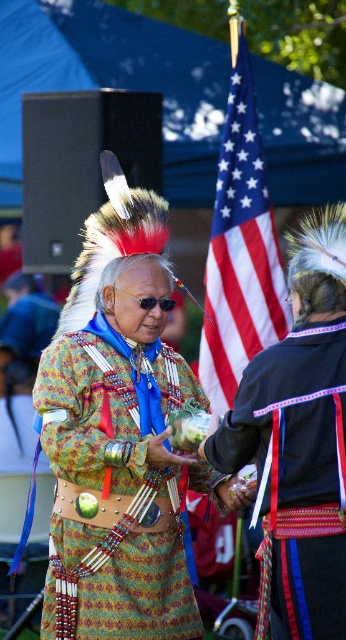
You are observing a cultural event and notice two points marked in the image. One is at coordinates point (132, 394) and the other at point (243, 134). Which point is nearer to you?

Point (132, 394) is closer to the viewer than point (243, 134).

You are an anthropologist observing a cultural ceremony. You notice the multicolored woven fabric at center and the patterned fabric headdress at center. Which object is closer to you in the scene?

The multicolored woven fabric at center is closer to you because it is in front of the patterned fabric headdress at center.

You are attending a cultural ceremony and see the multicolored woven fabric at center and the american flag at center. Which item is positioned lower in the scene?

The multicolored woven fabric at center is positioned below the american flag at center, so it is lower in the scene.